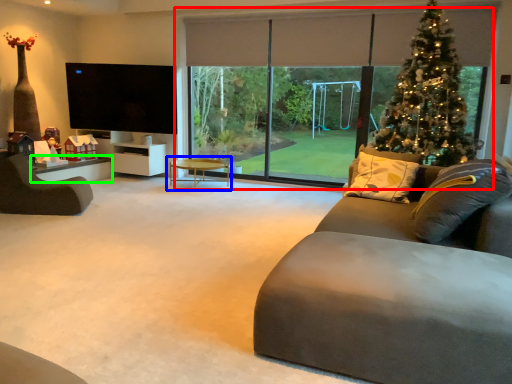
Question: Considering the real-world distances, which object is farthest from window (highlighted by a red box)? coffee table (highlighted by a blue box) or table (highlighted by a green box)?

Choices:
 (A) coffee table
 (B) table

Answer: (B)